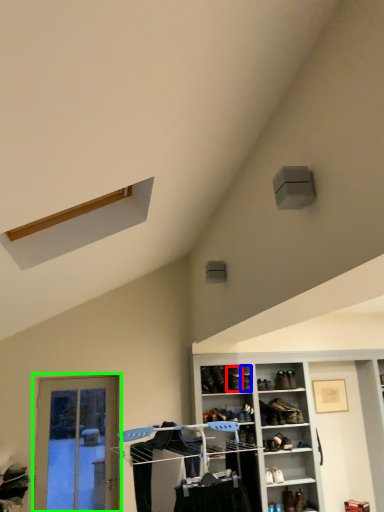
Question: Based on their relative distances, which object is farther from shoe (highlighted by a red box)? Choose from shoe (highlighted by a blue box) and screen door (highlighted by a green box).

Choices:
 (A) shoe
 (B) screen door

Answer: (B)